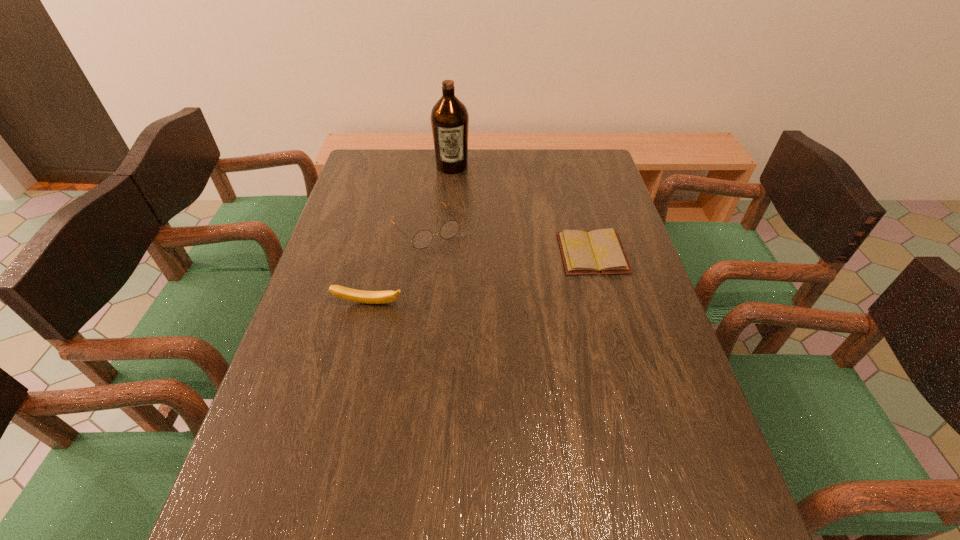
Locate an element on the screen. vacant point located between the olive oil and the banana is located at coordinates (411, 235).

This screenshot has width=960, height=540. In order to click on free space between the diary and the banana in this screenshot , I will do `click(481, 278)`.

Locate an element on the screen. unoccupied area between the farthest object and the spectacles is located at coordinates (438, 198).

You are a GUI agent. You are given a task and a screenshot of the screen. Output one action in this format:
    pyautogui.click(x=<x>, y=<y>)
    Task: Click on the free space between the diary and the spectacles
    Image resolution: width=960 pixels, height=540 pixels.
    Given the screenshot: What is the action you would take?
    pyautogui.click(x=508, y=241)

Identify which object is located as the nearest to the nearest object. Please provide its 2D coordinates. Your answer should be formatted as a tuple, i.e. [(x, y)], where the tuple contains the x and y coordinates of a point satisfying the conditions above.

[(422, 239)]

Identify the location of the third closest object relative to the olive oil. The image size is (960, 540). (370, 297).

In order to click on vacant space that satisfies the following two spatial constraints: 1. on the front side of the rightmost object; 2. on the left side of the spectacles in this screenshot , I will do `click(420, 253)`.